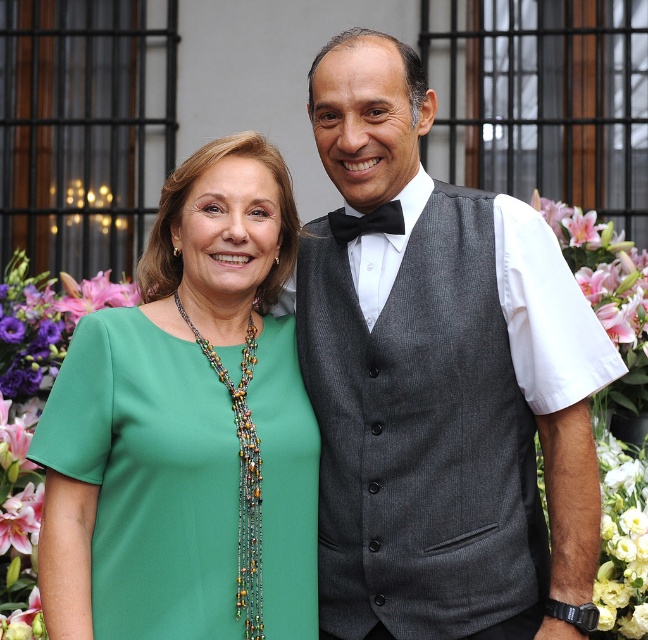
You are a photographer setting up for a portrait. You notice the black satin bow tie at center and the pink lily at upper right in the scene. Which object is positioned higher in the image?

The pink lily at upper right is positioned higher than the black satin bow tie at center.